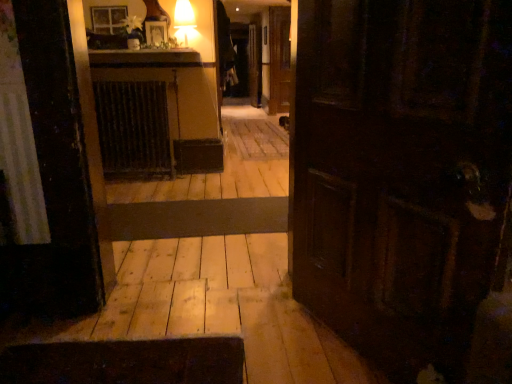
Question: Can you confirm if dark brown metal radiator at center is shorter than wooden floor at center?

Choices:
 (A) yes
 (B) no

Answer: (B)

Question: From the image's perspective, is dark brown metal radiator at center beneath wooden floor at center?

Choices:
 (A) no
 (B) yes

Answer: (A)

Question: Are dark brown metal radiator at center and wooden floor at center far apart?

Choices:
 (A) no
 (B) yes

Answer: (B)

Question: Is dark brown metal radiator at center at the left side of wooden floor at center?

Choices:
 (A) yes
 (B) no

Answer: (A)

Question: From a real-world perspective, is dark brown metal radiator at center located beneath wooden floor at center?

Choices:
 (A) yes
 (B) no

Answer: (B)

Question: Considering the relative sizes of dark brown metal radiator at center and wooden floor at center in the image provided, is dark brown metal radiator at center wider than wooden floor at center?

Choices:
 (A) yes
 (B) no

Answer: (B)

Question: Considering the relative positions of wooden floor at center and dark brown metal radiator at center in the image provided, is wooden floor at center to the left of dark brown metal radiator at center from the viewer's perspective?

Choices:
 (A) no
 (B) yes

Answer: (A)

Question: Could you tell me if wooden floor at center is facing dark brown metal radiator at center?

Choices:
 (A) no
 (B) yes

Answer: (A)

Question: Is wooden floor at center oriented away from dark brown metal radiator at center?

Choices:
 (A) no
 (B) yes

Answer: (A)

Question: From the image's perspective, would you say wooden floor at center is positioned over dark brown metal radiator at center?

Choices:
 (A) no
 (B) yes

Answer: (A)

Question: From a real-world perspective, is wooden floor at center under dark brown metal radiator at center?

Choices:
 (A) no
 (B) yes

Answer: (B)

Question: Does wooden floor at center touch dark brown metal radiator at center?

Choices:
 (A) no
 (B) yes

Answer: (A)

Question: From a real-world perspective, is wooden floor at center above or below dark brown metal radiator at center?

Choices:
 (A) below
 (B) above

Answer: (A)